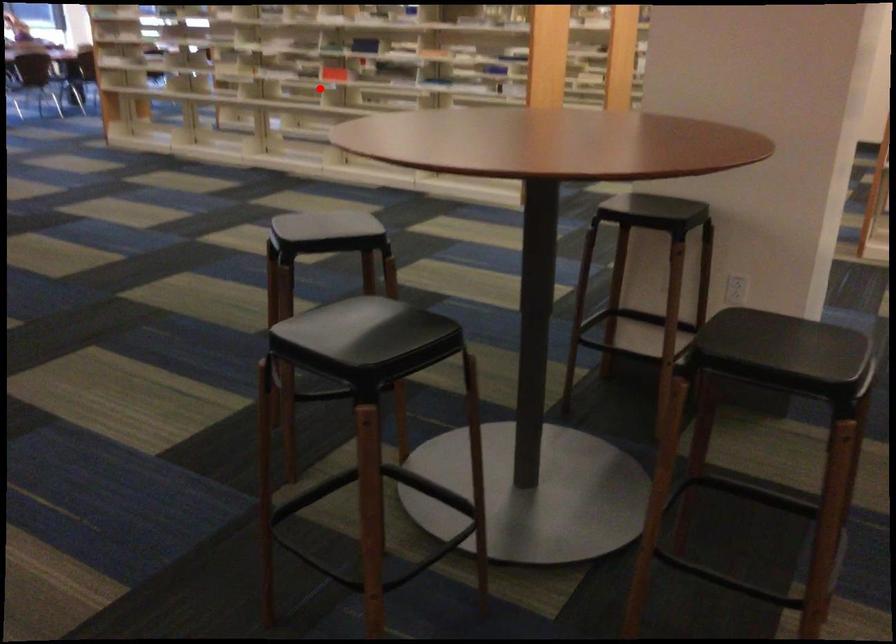
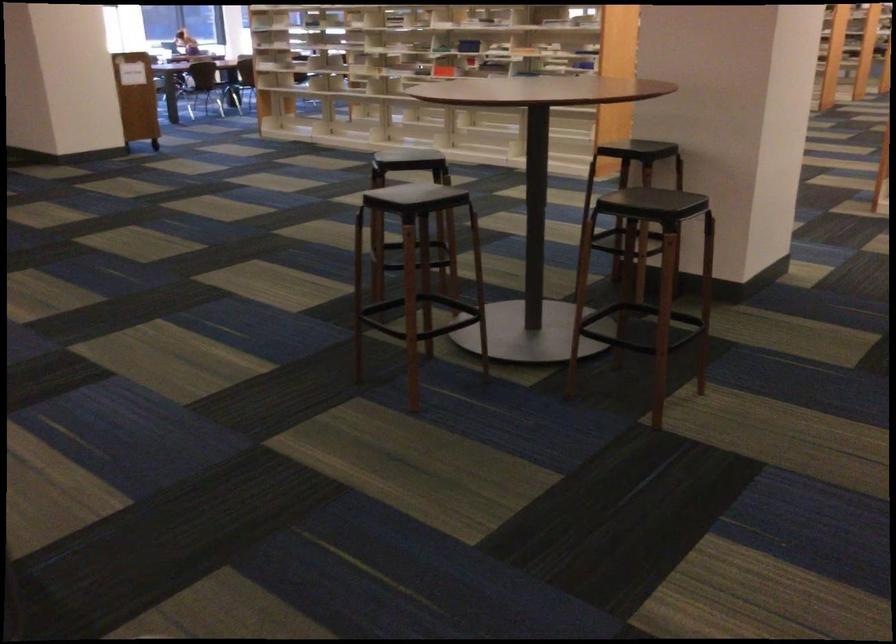
Question: A red point is marked in image1. In image2, is the corresponding 3D point closer to the camera or farther? Reply with the corresponding letter.

Choices:
 (A) The corresponding 3D point is closer.
 (B) The corresponding 3D point is farther.

Answer: (B)